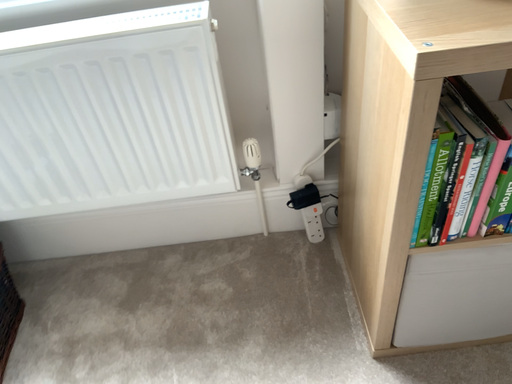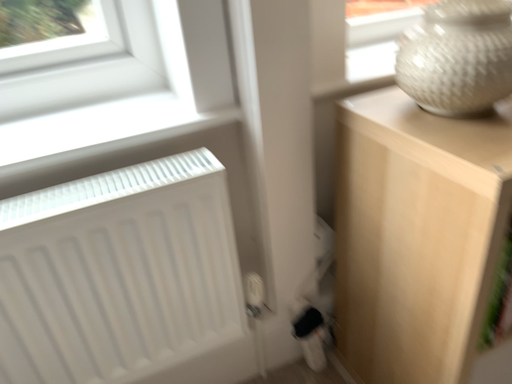
Question: How did the camera likely rotate when shooting the video?

Choices:
 (A) rotated right
 (B) rotated left

Answer: (A)